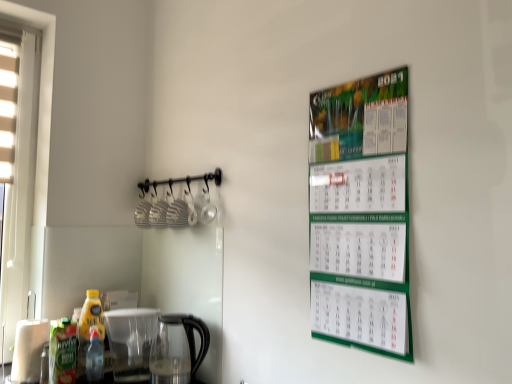
The height and width of the screenshot is (384, 512). What are the coordinates of `translucent plastic bottle at lower left, the third bottle from the left` in the screenshot? It's located at (94, 357).

In order to face transparent glass coffeepot at lower center, should I rotate leftwards or rightwards?

You should rotate left by 10.410 degrees.

Locate an element on the screen. translucent plastic bottle at lower left, the third bottle from the left is located at coordinates (94, 357).

Consider the image. Who is smaller, translucent plastic bottle at lower left, arranged as the 1th bottle when viewed from the right, or transparent glass coffeepot at lower center?

translucent plastic bottle at lower left, arranged as the 1th bottle when viewed from the right.

Could transparent glass coffeepot at lower center be considered to be inside translucent plastic bottle at lower left, the third bottle from the left?

That's incorrect, transparent glass coffeepot at lower center is not inside translucent plastic bottle at lower left, the third bottle from the left.

Is point (91, 374) closer to camera compared to point (176, 374)?

No, it is behind (176, 374).

Where is `coffeepot located below the green matte juice at lower left, the first bottle in the left-to-right sequence (from the image's perspective)`? coffeepot located below the green matte juice at lower left, the first bottle in the left-to-right sequence (from the image's perspective) is located at coordinates (177, 349).

Considering the sizes of objects transparent glass coffeepot at lower center and green matte juice at lower left, the 3th bottle positioned from the right, in the image provided, who is shorter, transparent glass coffeepot at lower center or green matte juice at lower left, the 3th bottle positioned from the right,?

green matte juice at lower left, the 3th bottle positioned from the right, is shorter.

Is green matte juice at lower left, the 3th bottle positioned from the right, at the back of transparent glass coffeepot at lower center?

transparent glass coffeepot at lower center is not turned away from green matte juice at lower left, the 3th bottle positioned from the right.

From the image's perspective, is transparent glass coffeepot at lower center above or below green matte juice at lower left, the first bottle in the left-to-right sequence?

transparent glass coffeepot at lower center is below green matte juice at lower left, the first bottle in the left-to-right sequence.

Does green matte juice at lower left, the first bottle in the left-to-right sequence, contain translucent plastic bottle at lower left, the third bottle from the left?

No.

The width and height of the screenshot is (512, 384). I want to click on bottle that is the 1st object above the translucent plastic bottle at lower left, arranged as the 1th bottle when viewed from the right (from a real-world perspective), so click(62, 351).

Is point (63, 335) farther from viewer compared to point (93, 345)?

No.

Can you confirm if green matte juice at lower left, the first bottle in the left-to-right sequence, is wider than translucent plastic bottle at lower left, arranged as the 1th bottle when viewed from the right?

Yes, green matte juice at lower left, the first bottle in the left-to-right sequence, is wider than translucent plastic bottle at lower left, arranged as the 1th bottle when viewed from the right.

Which point is more distant from viewer, (196, 319) or (384, 299)?

The point (196, 319) is farther.

From the image's perspective, which is above, transparent glass coffeepot at lower center or green matte calendar at upper right?

green matte calendar at upper right.

Which of these two, transparent glass coffeepot at lower center or green matte calendar at upper right, is wider?

transparent glass coffeepot at lower center.

Measure the distance between green matte calendar at upper right and transparent glass coffeepot at lower center.

They are 29.03 inches apart.

I want to click on coffeepot to the left of green matte calendar at upper right, so click(177, 349).

Is green matte calendar at upper right smaller than transparent glass coffeepot at lower center?

Yes, green matte calendar at upper right is smaller than transparent glass coffeepot at lower center.

From a real-world perspective, between green matte calendar at upper right and translucent plastic bottle at lower left, arranged as the 1th bottle when viewed from the right, who is vertically lower?

In real-world perspective, translucent plastic bottle at lower left, arranged as the 1th bottle when viewed from the right, is lower.

In the scene shown: Is green matte calendar at upper right not near translucent plastic bottle at lower left, the third bottle from the left?

Indeed, green matte calendar at upper right is not near translucent plastic bottle at lower left, the third bottle from the left.

Which of these two, green matte calendar at upper right or translucent plastic bottle at lower left, arranged as the 1th bottle when viewed from the right, is bigger?

Bigger between the two is green matte calendar at upper right.

Find the location of `coffeepot directly beneath the green matte juice at lower left, the first bottle in the left-to-right sequence (from a real-world perspective)`. coffeepot directly beneath the green matte juice at lower left, the first bottle in the left-to-right sequence (from a real-world perspective) is located at coordinates (177, 349).

Is green matte juice at lower left, the first bottle in the left-to-right sequence, looking in the opposite direction of transparent glass coffeepot at lower center?

No.

Is there a large distance between green matte juice at lower left, the 3th bottle positioned from the right, and transparent glass coffeepot at lower center?

No, green matte juice at lower left, the 3th bottle positioned from the right, is in close proximity to transparent glass coffeepot at lower center.

Considering the relative sizes of green matte juice at lower left, the 3th bottle positioned from the right, and transparent glass coffeepot at lower center in the image provided, is green matte juice at lower left, the 3th bottle positioned from the right, thinner than transparent glass coffeepot at lower center?

Indeed, green matte juice at lower left, the 3th bottle positioned from the right, has a lesser width compared to transparent glass coffeepot at lower center.

Identify the location of coffeepot located above the translucent plastic bottle at lower left, arranged as the 1th bottle when viewed from the right (from a real-world perspective). The height and width of the screenshot is (384, 512). (177, 349).

Where is `the 1st bottle above the transparent glass coffeepot at lower center (from the image's perspective)`? This screenshot has width=512, height=384. the 1st bottle above the transparent glass coffeepot at lower center (from the image's perspective) is located at coordinates (62, 351).

When comparing their distances from green matte juice at lower left, the first bottle in the left-to-right sequence, does translucent plastic bottle at lower left, the third bottle from the left, or green matte calendar at upper right seem further?

green matte calendar at upper right.

Looking at the image, which one is located closer to green matte juice at lower left, the 3th bottle positioned from the right, yellow plastic bottle at lower left, arranged as the 2th bottle when viewed from the left, or translucent plastic bottle at lower left, the third bottle from the left?

yellow plastic bottle at lower left, arranged as the 2th bottle when viewed from the left, is positioned closer to the anchor green matte juice at lower left, the 3th bottle positioned from the right.

From the image, which object appears to be farther from translucent plastic bottle at lower left, arranged as the 1th bottle when viewed from the right, green matte calendar at upper right or green matte juice at lower left, the first bottle in the left-to-right sequence?

The object further to translucent plastic bottle at lower left, arranged as the 1th bottle when viewed from the right, is green matte calendar at upper right.

Looking at the image, which one is located closer to green matte juice at lower left, the 3th bottle positioned from the right, translucent plastic bottle at lower left, the third bottle from the left, or transparent glass coffeepot at lower center?

translucent plastic bottle at lower left, the third bottle from the left.

From the image, which object appears to be farther from translucent plastic bottle at lower left, arranged as the 1th bottle when viewed from the right, yellow plastic bottle at lower left, acting as the second bottle starting from the right, or green matte juice at lower left, the first bottle in the left-to-right sequence?

green matte juice at lower left, the first bottle in the left-to-right sequence, lies further to translucent plastic bottle at lower left, arranged as the 1th bottle when viewed from the right, than the other object.

Which object lies further to the anchor point yellow plastic bottle at lower left, arranged as the 2th bottle when viewed from the left, green matte juice at lower left, the 3th bottle positioned from the right, or green matte calendar at upper right?

Among the two, green matte calendar at upper right is located further to yellow plastic bottle at lower left, arranged as the 2th bottle when viewed from the left.

Looking at the image, which one is located closer to transparent glass coffeepot at lower center, green matte juice at lower left, the 3th bottle positioned from the right, or yellow plastic bottle at lower left, arranged as the 2th bottle when viewed from the left?

yellow plastic bottle at lower left, arranged as the 2th bottle when viewed from the left, is positioned closer to the anchor transparent glass coffeepot at lower center.

Looking at this image, looking at the image, which one is located further to yellow plastic bottle at lower left, acting as the second bottle starting from the right, translucent plastic bottle at lower left, the third bottle from the left, or green matte juice at lower left, the first bottle in the left-to-right sequence?

Based on the image, green matte juice at lower left, the first bottle in the left-to-right sequence, appears to be further to yellow plastic bottle at lower left, acting as the second bottle starting from the right.

The height and width of the screenshot is (384, 512). In order to click on bottle between yellow plastic bottle at lower left, arranged as the 2th bottle when viewed from the left, and green matte calendar at upper right in this screenshot , I will do `click(94, 357)`.

This screenshot has height=384, width=512. I want to click on coffeepot between translucent plastic bottle at lower left, the third bottle from the left, and green matte calendar at upper right from left to right, so click(x=177, y=349).

Identify the location of coffeepot between yellow plastic bottle at lower left, acting as the second bottle starting from the right, and green matte calendar at upper right, in the horizontal direction. This screenshot has height=384, width=512. [177, 349].

Locate an element on the screen. coffeepot situated between green matte juice at lower left, the first bottle in the left-to-right sequence, and green matte calendar at upper right from left to right is located at coordinates (177, 349).